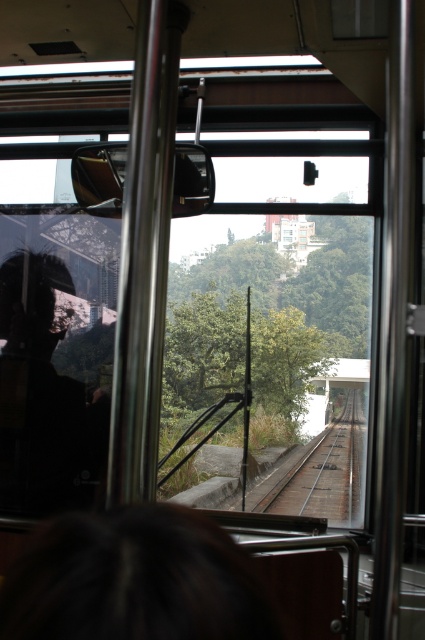
Question: Does dark brown hair at lower center have a smaller size compared to silhouette glass at left?

Choices:
 (A) no
 (B) yes

Answer: (B)

Question: Does dark brown hair at lower center have a greater width compared to brown wooden train track at center?

Choices:
 (A) no
 (B) yes

Answer: (A)

Question: Considering the real-world distances, which object is closest to the silhouette glass at left?

Choices:
 (A) dark brown hair at lower center
 (B) brown wooden train track at center

Answer: (B)

Question: Where is silhouette glass at left located in relation to brown wooden train track at center in the image?

Choices:
 (A) left
 (B) right

Answer: (A)

Question: Which of the following is the closest to the observer?

Choices:
 (A) silhouette glass at left
 (B) green leafy tree at center
 (C) dark brown hair at lower center
 (D) brown wooden train track at center

Answer: (C)

Question: Which point is farther to the camera?

Choices:
 (A) green leafy tree at center
 (B) brown wooden train track at center

Answer: (A)